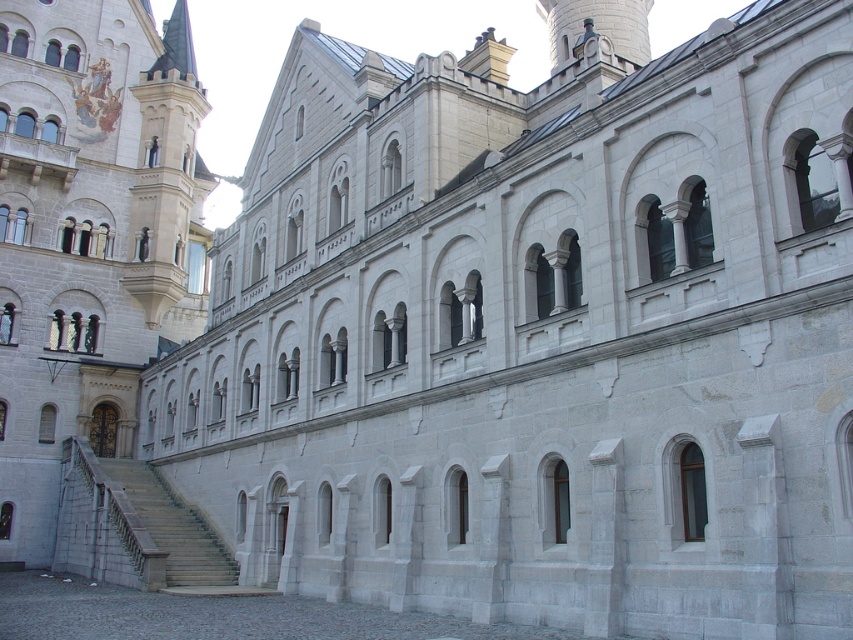
You are a tour guide leading a group to the entrance of the historic building. You notice two paths leading up to the entrance. Which path should you take if you want to choose the larger one between the light gray stone staircase at lower left and the gray stone stairs at lower left?

You should take the light gray stone staircase at lower left because it is larger in size than the gray stone stairs at lower left.

You are a visitor approaching the entrance of the historic building. You see the light gray stone staircase at lower left and the gray stone stairs at lower left. Which one is above the other?

The light gray stone staircase at lower left is positioned over the gray stone stairs at lower left, so the staircase is above the stairs.